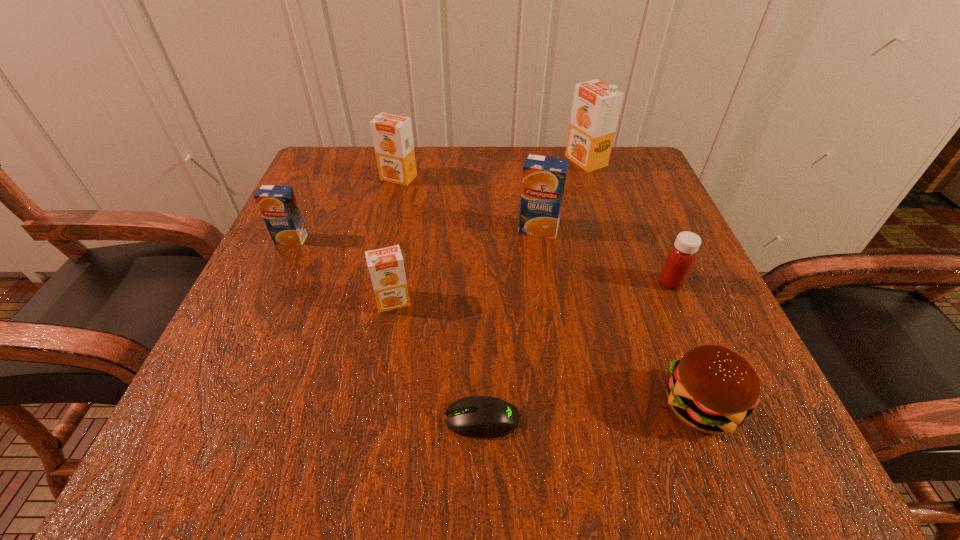
Locate an element on the screen. The image size is (960, 540). orange juice that is the closest to the brown hamburger is located at coordinates (543, 182).

Locate which orange orange juice ranks second in proximity to the red medicine. Please provide its 2D coordinates. Your answer should be formatted as a tuple, i.e. [(x, y)], where the tuple contains the x and y coordinates of a point satisfying the conditions above.

[(386, 266)]

Locate which orange orange juice is the closest to the second smallest orange orange juice. Please provide its 2D coordinates. Your answer should be formatted as a tuple, i.e. [(x, y)], where the tuple contains the x and y coordinates of a point satisfying the conditions above.

[(386, 266)]

The height and width of the screenshot is (540, 960). Identify the location of free space that satisfies the following two spatial constraints: 1. on the front side of the fourth object from right to left; 2. on the right side of the red medicine. (546, 282).

The height and width of the screenshot is (540, 960). I want to click on vacant space that satisfies the following two spatial constraints: 1. on the back side of the leftmost object; 2. on the left side of the second smallest orange orange juice, so click(320, 178).

Where is `free space that satisfies the following two spatial constraints: 1. on the back side of the smaller blue orange_juice; 2. on the right side of the bigger blue orange_juice`? free space that satisfies the following two spatial constraints: 1. on the back side of the smaller blue orange_juice; 2. on the right side of the bigger blue orange_juice is located at coordinates (296, 229).

Where is `free spot that satisfies the following two spatial constraints: 1. on the front side of the brown hamburger; 2. on the left side of the nearest orange juice`? free spot that satisfies the following two spatial constraints: 1. on the front side of the brown hamburger; 2. on the left side of the nearest orange juice is located at coordinates (373, 405).

Locate an element on the screen. This screenshot has width=960, height=540. free location that satisfies the following two spatial constraints: 1. on the front side of the second biggest orange orange juice; 2. on the right side of the red medicine is located at coordinates (374, 282).